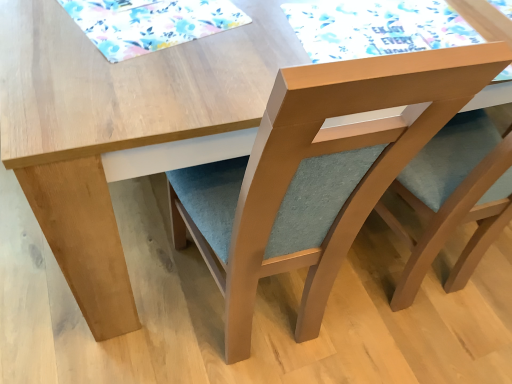
Question: Does matte wood chair at center have a greater width compared to watercolor paper placemat at upper center, which is counted as the first mat, starting from the right?

Choices:
 (A) no
 (B) yes

Answer: (B)

Question: Considering the relative positions of matte wood chair at center and watercolor paper placemat at upper center, the second mat from the left, in the image provided, is matte wood chair at center to the right of watercolor paper placemat at upper center, the second mat from the left, from the viewer's perspective?

Choices:
 (A) no
 (B) yes

Answer: (A)

Question: Is matte wood chair at center turned away from watercolor paper placemat at upper center, the second mat from the left?

Choices:
 (A) no
 (B) yes

Answer: (A)

Question: Considering the relative sizes of matte wood chair at center and watercolor paper placemat at upper center, the second mat from the left, in the image provided, is matte wood chair at center thinner than watercolor paper placemat at upper center, the second mat from the left,?

Choices:
 (A) yes
 (B) no

Answer: (B)

Question: Is matte wood chair at center shorter than watercolor paper placemat at upper center, which is counted as the first mat, starting from the right?

Choices:
 (A) no
 (B) yes

Answer: (A)

Question: Considering their positions, is floral fabric placemat at upper left, which is the second mat from right to left, located in front of or behind watercolor paper placemat at upper center, the second mat from the left?

Choices:
 (A) front
 (B) behind

Answer: (A)

Question: From a real-world perspective, is floral fabric placemat at upper left, acting as the 1th mat starting from the left, above or below watercolor paper placemat at upper center, the second mat from the left?

Choices:
 (A) above
 (B) below

Answer: (A)

Question: Is point (168, 4) positioned closer to the camera than point (295, 23)?

Choices:
 (A) farther
 (B) closer

Answer: (B)

Question: Choose the correct answer: Is floral fabric placemat at upper left, which is the second mat from right to left, inside watercolor paper placemat at upper center, which is counted as the first mat, starting from the right, or outside it?

Choices:
 (A) inside
 (B) outside

Answer: (B)

Question: Considering the positions of floral fabric placemat at upper left, which is the second mat from right to left, and matte wood chair at center in the image, is floral fabric placemat at upper left, which is the second mat from right to left, taller or shorter than matte wood chair at center?

Choices:
 (A) tall
 (B) short

Answer: (B)

Question: From a real-world perspective, relative to matte wood chair at center, is floral fabric placemat at upper left, which is the second mat from right to left, vertically above or below?

Choices:
 (A) above
 (B) below

Answer: (A)

Question: From the image's perspective, is floral fabric placemat at upper left, which is the second mat from right to left, located above or below matte wood chair at center?

Choices:
 (A) below
 (B) above

Answer: (B)

Question: Does point (92, 8) appear closer or farther from the camera than point (188, 195)?

Choices:
 (A) closer
 (B) farther

Answer: (A)

Question: From a real-world perspective, is matte wood chair at center above or below watercolor paper placemat at upper center, which is counted as the first mat, starting from the right?

Choices:
 (A) below
 (B) above

Answer: (A)

Question: Considering the positions of matte wood chair at center and watercolor paper placemat at upper center, which is counted as the first mat, starting from the right, in the image, is matte wood chair at center wider or thinner than watercolor paper placemat at upper center, which is counted as the first mat, starting from the right,?

Choices:
 (A) thin
 (B) wide

Answer: (B)